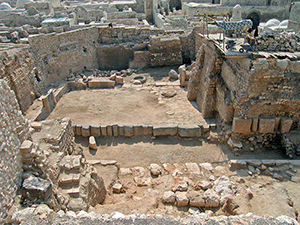
This screenshot has height=225, width=300. Identify the location of wall. (76, 60), (115, 54), (11, 153), (25, 98).